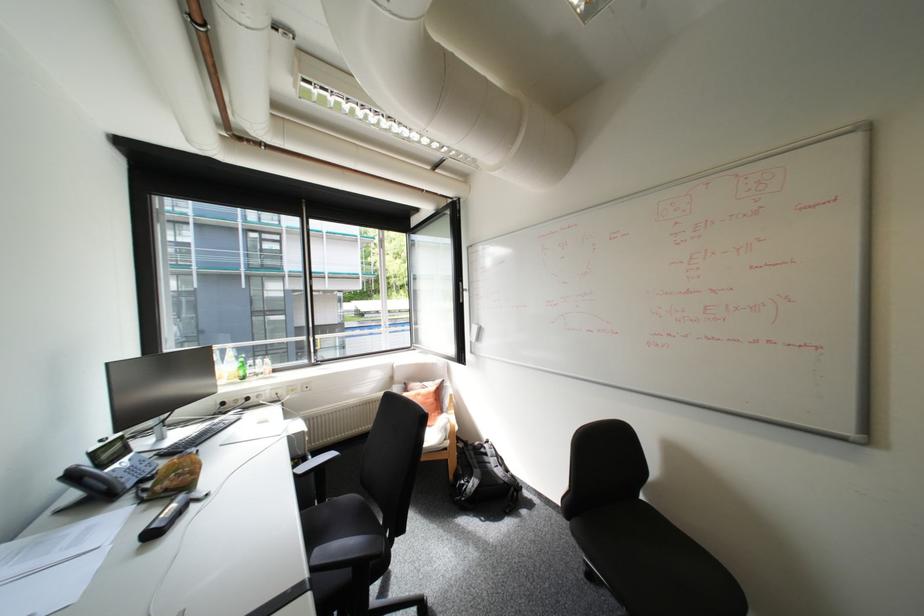
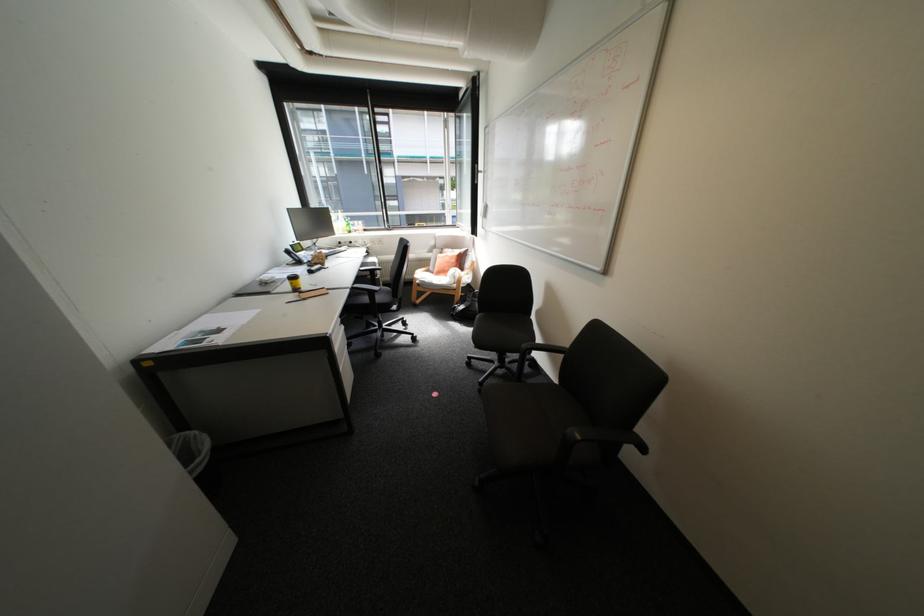
Locate, in the second image, the point that corresponds to [497,523] in the first image.

(473, 326)